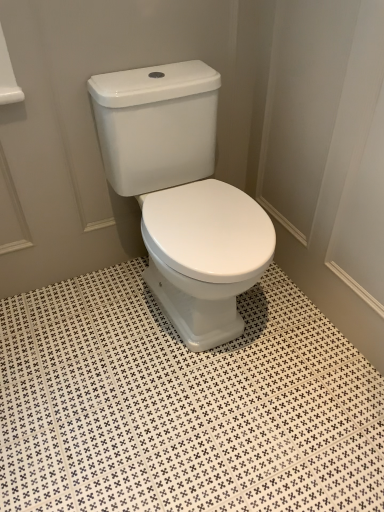
The height and width of the screenshot is (512, 384). What do you see at coordinates (182, 405) in the screenshot? I see `white glossy ceramic tile at center` at bounding box center [182, 405].

At what (x,y) coordinates should I click in order to perform the action: click on white glossy ceramic tile at center. Please return your answer as a coordinate pair (x, y). Looking at the image, I should click on (182, 405).

Image resolution: width=384 pixels, height=512 pixels. I want to click on white glossy toilet at center, so click(x=182, y=195).

What is the approximate height of white glossy toilet at center?

white glossy toilet at center is 30.68 inches in height.

This screenshot has width=384, height=512. What do you see at coordinates (182, 195) in the screenshot? I see `white glossy toilet at center` at bounding box center [182, 195].

Find the location of `white glossy ceramic tile at center`. white glossy ceramic tile at center is located at coordinates (182, 405).

Does white glossy toilet at center appear on the right side of white glossy ceramic tile at center?

Yes.

Which object is further away from the camera, white glossy toilet at center or white glossy ceramic tile at center?

white glossy toilet at center is more distant.

Does point (147, 237) come in front of point (71, 366)?

That is True.

From the image's perspective, who appears lower, white glossy toilet at center or white glossy ceramic tile at center?

white glossy ceramic tile at center.

From a real-world perspective, between white glossy toilet at center and white glossy ceramic tile at center, who is vertically higher?

white glossy toilet at center.

Is white glossy toilet at center thinner than white glossy ceramic tile at center?

Yes.

Considering the relative sizes of white glossy toilet at center and white glossy ceramic tile at center in the image provided, is white glossy toilet at center taller than white glossy ceramic tile at center?

Indeed, white glossy toilet at center has a greater height compared to white glossy ceramic tile at center.

Considering the relative sizes of white glossy toilet at center and white glossy ceramic tile at center in the image provided, is white glossy toilet at center smaller than white glossy ceramic tile at center?

No.

Choose the correct answer: Is white glossy toilet at center inside white glossy ceramic tile at center or outside it?

The correct answer is: outside.

Is white glossy toilet at center far from white glossy ceramic tile at center?

Actually, white glossy toilet at center and white glossy ceramic tile at center are a little close together.

Is white glossy toilet at center turned away from white glossy ceramic tile at center?

No, white glossy toilet at center is not facing away from white glossy ceramic tile at center.

How distant is white glossy toilet at center from white glossy ceramic tile at center?

They are 15.59 inches apart.

Identify the location of toilet above the white glossy ceramic tile at center (from the image's perspective). 182,195.

Considering the relative positions of white glossy ceramic tile at center and white glossy toilet at center in the image provided, is white glossy ceramic tile at center to the left or to the right of white glossy toilet at center?

From the image, it's evident that white glossy ceramic tile at center is to the left of white glossy toilet at center.

Considering the positions of objects white glossy ceramic tile at center and white glossy toilet at center in the image provided, who is in front, white glossy ceramic tile at center or white glossy toilet at center?

white glossy ceramic tile at center is in front.

Is point (29, 311) closer to camera compared to point (158, 147)?

No, it is behind (158, 147).

From the image's perspective, between white glossy ceramic tile at center and white glossy toilet at center, who is located below?

white glossy ceramic tile at center is shown below in the image.

From a real-world perspective, is white glossy ceramic tile at center physically located above or below white glossy toilet at center?

In terms of real-world spatial position, white glossy ceramic tile at center is below white glossy toilet at center.

Can you confirm if white glossy ceramic tile at center is thinner than white glossy toilet at center?

No, white glossy ceramic tile at center is not thinner than white glossy toilet at center.

Who is taller, white glossy ceramic tile at center or white glossy toilet at center?

white glossy toilet at center is taller.

Is white glossy ceramic tile at center bigger or smaller than white glossy toilet at center?

Considering their sizes, white glossy ceramic tile at center takes up less space than white glossy toilet at center.

Is white glossy ceramic tile at center not inside white glossy toilet at center?

Indeed, white glossy ceramic tile at center is completely outside white glossy toilet at center.

Is white glossy ceramic tile at center far away from white glossy toilet at center?

Actually, white glossy ceramic tile at center and white glossy toilet at center are a little close together.

Is white glossy ceramic tile at center turned away from white glossy toilet at center?

white glossy ceramic tile at center does not have its back to white glossy toilet at center.

You are a GUI agent. You are given a task and a screenshot of the screen. Output one action in this format:
    pyautogui.click(x=<x>, y=<y>)
    Task: Click on the toilet above the white glossy ceramic tile at center (from a real-world perspective)
    This screenshot has width=384, height=512.
    Given the screenshot: What is the action you would take?
    pyautogui.click(x=182, y=195)

The image size is (384, 512). I want to click on ceramic tile lying on the left of white glossy toilet at center, so click(x=182, y=405).

At what (x,y) coordinates should I click in order to perform the action: click on toilet above the white glossy ceramic tile at center (from the image's perspective). Please return your answer as a coordinate pair (x, y). The height and width of the screenshot is (512, 384). Looking at the image, I should click on (182, 195).